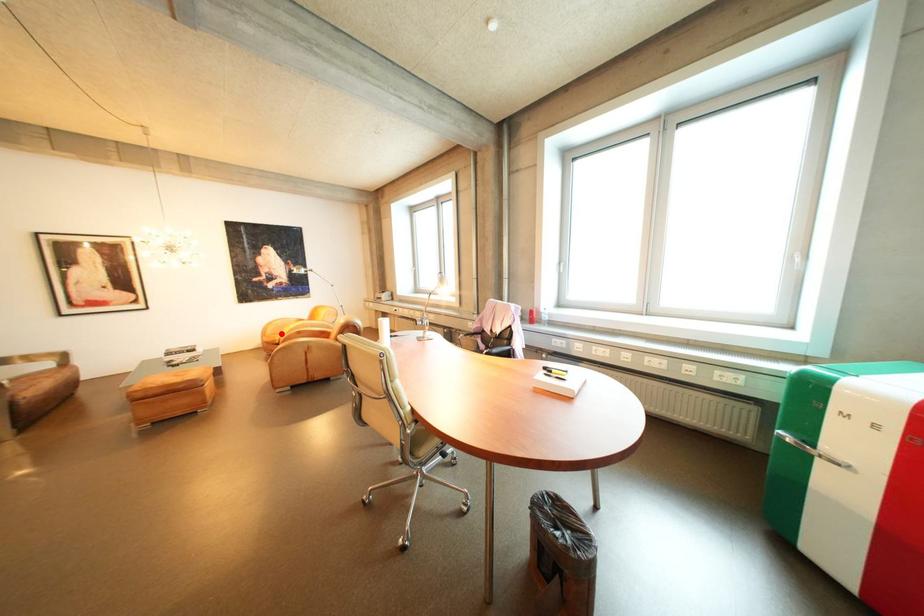
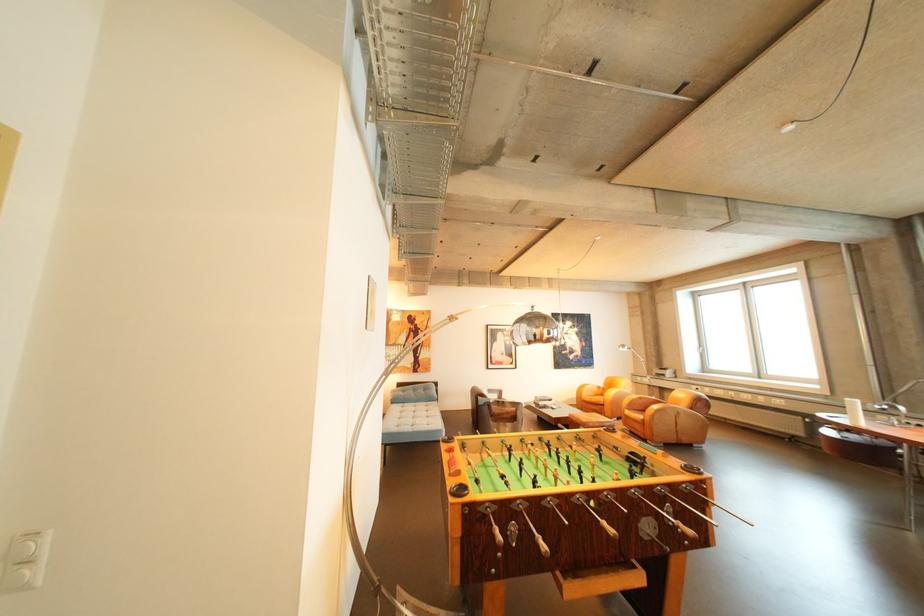
The point at the highlighted location is marked in the first image. Where is the corresponding point in the second image?

(598, 395)